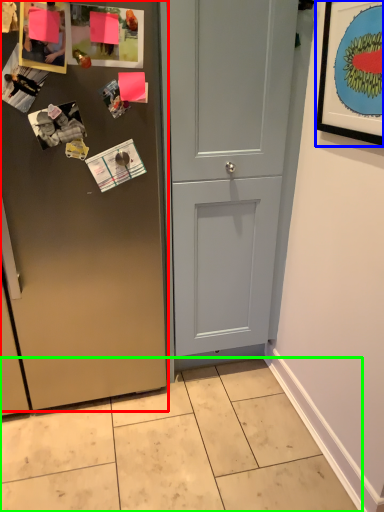
Question: Which object is positioned closest to door (highlighted by a red box)? Select from picture frame (highlighted by a blue box) and tile (highlighted by a green box).

Choices:
 (A) picture frame
 (B) tile

Answer: (B)